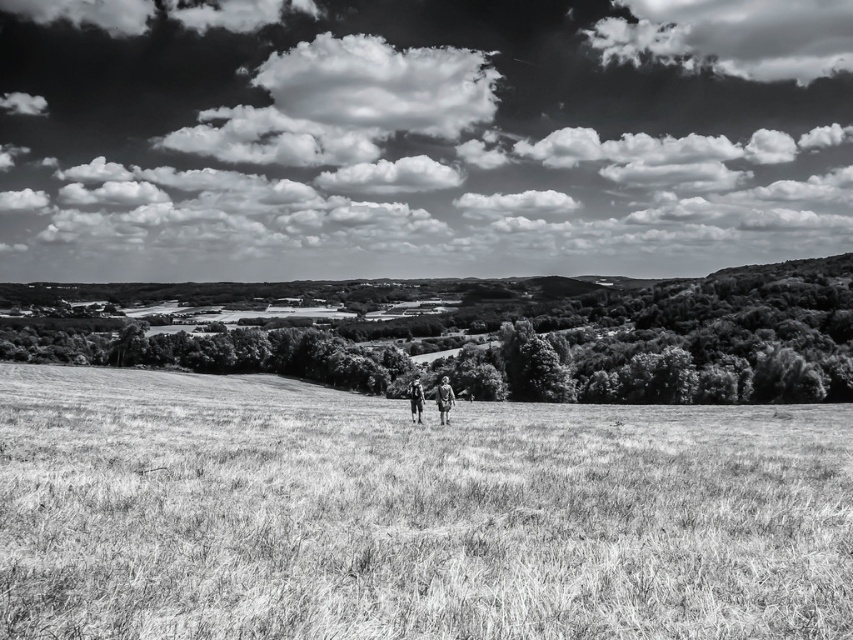
This screenshot has width=853, height=640. What do you see at coordinates (444, 400) in the screenshot? I see `wooden figure at center` at bounding box center [444, 400].

Is wooden figure at center shorter than camouflage fabric person at center?

Correct, wooden figure at center is not as tall as camouflage fabric person at center.

The image size is (853, 640). In order to click on wooden figure at center in this screenshot , I will do click(x=444, y=400).

Is point (582, 604) in front of point (450, 390)?

Yes.

Is point (157, 445) farther from viewer compared to point (439, 390)?

No, (157, 445) is closer to viewer.

Identify the location of grassy at center. The height and width of the screenshot is (640, 853). (410, 513).

Can you confirm if grassy at center is positioned below camouflage fabric person at center?

No.

Can you confirm if grassy at center is smaller than camouflage fabric person at center?

No, grassy at center is not smaller than camouflage fabric person at center.

Is point (540, 461) more distant than point (412, 406)?

That is False.

Where is `grassy at center`? Image resolution: width=853 pixels, height=640 pixels. grassy at center is located at coordinates (410, 513).